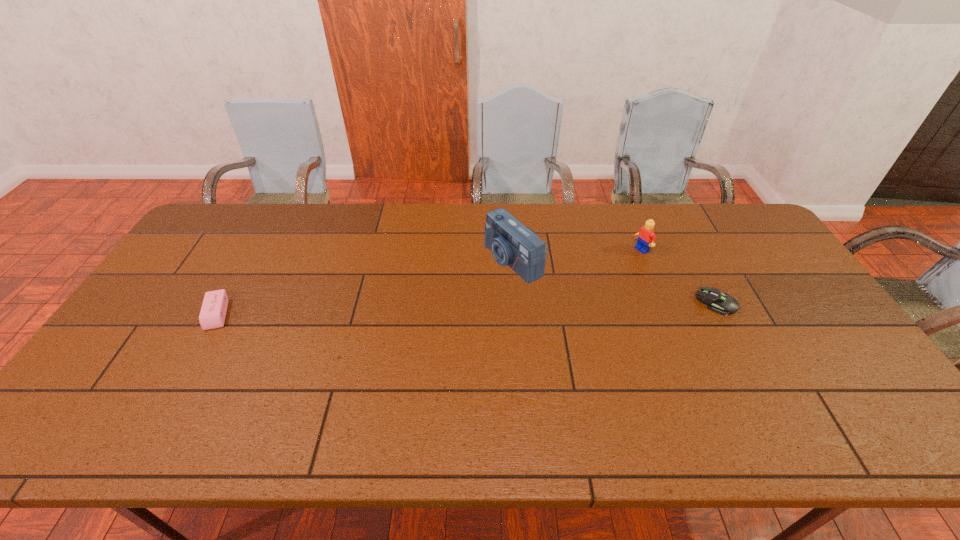
Where is `vacant space located 0.080m on the lens of the third object from right to left`? vacant space located 0.080m on the lens of the third object from right to left is located at coordinates (468, 284).

What are the coordinates of `vacant space situated 0.170m on the lens of the third object from right to left` in the screenshot? It's located at (442, 295).

Where is `free space located 0.060m on the face of the Lego`? The height and width of the screenshot is (540, 960). free space located 0.060m on the face of the Lego is located at coordinates (623, 260).

Find the location of a particular element. The width and height of the screenshot is (960, 540). vacant space located on the face of the Lego is located at coordinates (542, 301).

This screenshot has width=960, height=540. I want to click on free space located on the face of the Lego, so (x=614, y=265).

Find the location of a particular element. This screenshot has width=960, height=540. camera present at the far edge is located at coordinates (511, 243).

This screenshot has width=960, height=540. Find the location of `Lego present at the far edge`. Lego present at the far edge is located at coordinates (646, 235).

In the image, there is a desktop. Identify the location of free space at the far edge. (276, 244).

Identify the location of vacant region at the near edge of the desktop. (775, 376).

This screenshot has width=960, height=540. Identify the location of vacant space at the left edge of the desktop. (202, 285).